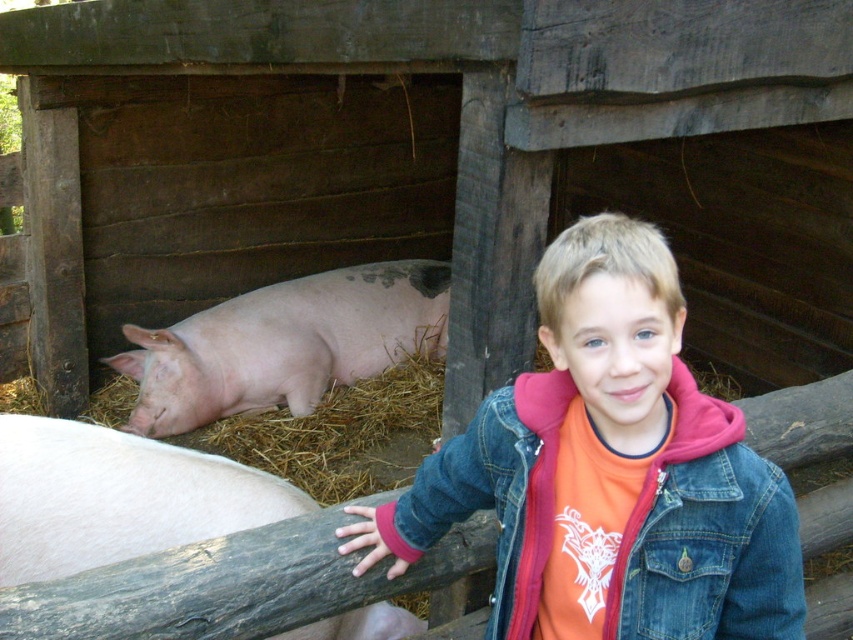
Which of these two, denim jacket at lower right or pink smooth skin at left, stands taller?

denim jacket at lower right is taller.

Does denim jacket at lower right lie in front of pink smooth skin at left?

Yes.

Who is more distant from viewer, (695,481) or (41,544)?

The point (41,544) is behind.

The image size is (853, 640). Identify the location of denim jacket at lower right. (608, 472).

Does pink smooth skin at left have a smaller size compared to pink matte/skinny pig at left?

Yes, pink smooth skin at left is smaller than pink matte/skinny pig at left.

Does pink smooth skin at left have a greater height compared to pink matte/skinny pig at left?

Incorrect, pink smooth skin at left's height is not larger of pink matte/skinny pig at left's.

The width and height of the screenshot is (853, 640). What do you see at coordinates (117, 497) in the screenshot?
I see `pink smooth skin at left` at bounding box center [117, 497].

The height and width of the screenshot is (640, 853). What are the coordinates of `pink smooth skin at left` in the screenshot? It's located at (117, 497).

Does denim jacket at lower right have a larger size compared to pink matte/skinny pig at left?

No.

Who is lower down, denim jacket at lower right or pink matte/skinny pig at left?

denim jacket at lower right

Between point (685, 380) and point (428, 284), which one is positioned in front?

Point (685, 380) is in front.

Locate an element on the screen. This screenshot has height=640, width=853. denim jacket at lower right is located at coordinates (608, 472).